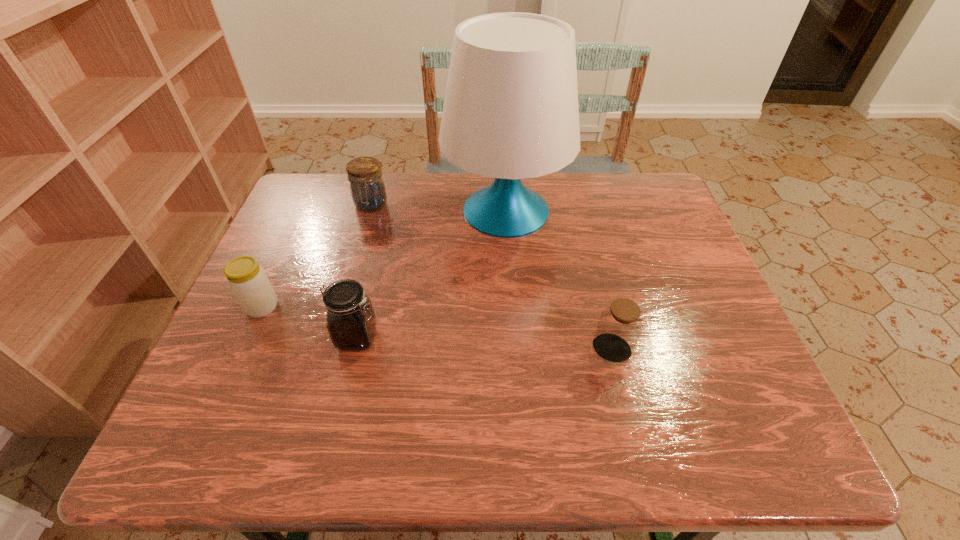
Locate an element on the screen. This screenshot has width=960, height=540. vacant region between the farthest jar and the rightmost jar is located at coordinates (492, 278).

Identify the location of empty space between the rightmost jar and the tallest object. (559, 280).

Where is `free space between the farthest jar and the table lamp`? free space between the farthest jar and the table lamp is located at coordinates (439, 208).

Where is `empty location between the tallest object and the farthest jar`? The image size is (960, 540). empty location between the tallest object and the farthest jar is located at coordinates (439, 208).

Locate an element on the screen. Image resolution: width=960 pixels, height=540 pixels. vacant area that lies between the farthest jar and the rightmost jar is located at coordinates (492, 278).

Where is `vacant area that lies between the leftmost object and the tallest object`? This screenshot has height=540, width=960. vacant area that lies between the leftmost object and the tallest object is located at coordinates (384, 259).

Where is `vacant space that's between the third nearest object and the rightmost jar`? The width and height of the screenshot is (960, 540). vacant space that's between the third nearest object and the rightmost jar is located at coordinates (437, 328).

Point out which object is positioned as the third nearest to the third nearest object. Please provide its 2D coordinates. Your answer should be formatted as a tuple, i.e. [(x, y)], where the tuple contains the x and y coordinates of a point satisfying the conditions above.

[(510, 112)]

At what (x,y) coordinates should I click in order to perform the action: click on object that is the second closest to the table lamp. Please return your answer as a coordinate pair (x, y). This screenshot has width=960, height=540. Looking at the image, I should click on (351, 323).

Select which jar appears as the third closest to the farthest jar. Please provide its 2D coordinates. Your answer should be formatted as a tuple, i.e. [(x, y)], where the tuple contains the x and y coordinates of a point satisfying the conditions above.

[(620, 324)]